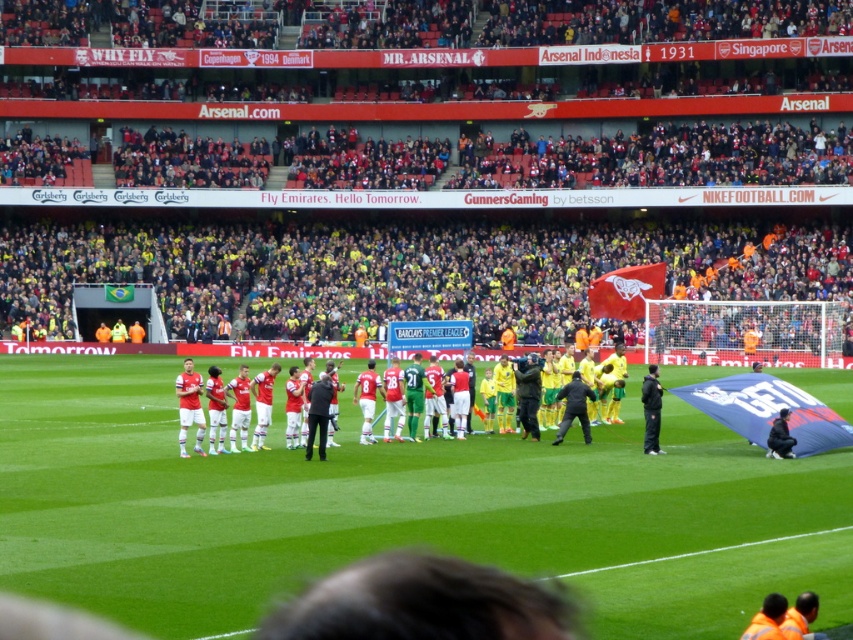
You are a photographer at the Emirates Stadium. You need to capture a photo where the green grass field at center is visible above the red jersey uniform at center. Is this possible based on their current positions?

Yes, the green grass field at center is taller than the red jersey uniform at center, so it will naturally appear above it in the photo.

You are a photographer standing on the sidelines of the football match at Emirates Stadium. You want to take a photo of the red jersey uniform at center and the green grass field at center. Based on their positions, which object should you focus on first to ensure both are in frame?

The green grass field at center is positioned on the left side of the red jersey uniform at center. Therefore, you should focus on the green grass field at center first to ensure both objects are captured in the frame.

You are a photographer standing at the edge of the pitch. You want to take a photo of the red jersey uniform at center and the green grass field at center. Which object is closer to you?

The red jersey uniform at center is closer to you since it is only 7.17 meters away from the green grass field at center, which is further back.